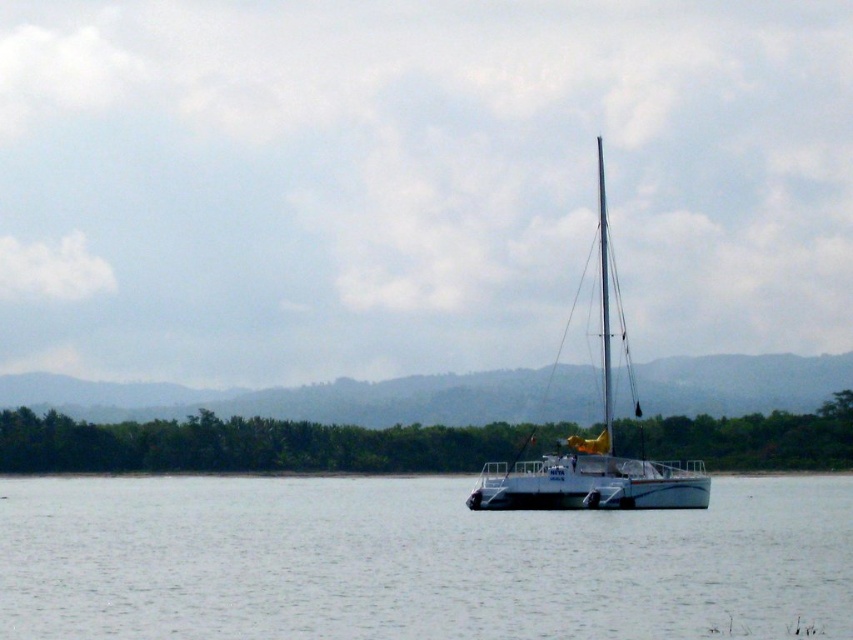
You are standing on a pier and see the clear water at center. If you want to throw a small stone into the water, will it land within 50 meters from where you are standing?

The clear water at center is 49.69 meters away from viewer, so yes, the stone will land within 50 meters from where you are standing.

You are a sailor trying to navigate your boat through the clear water at center. The white matte sailboat at center is in your path. Which direction should you steer to avoid it?

The clear water at center is to the left of the white matte sailboat at center, so you should steer to the right to avoid the white matte sailboat at center.

You are standing on the deck of the sailboat anchored off the right side of the frame and want to move to the clear water at center. Can you walk directly to the point marked by the coordinates (415, 561) without stepping on any obstacles?

The point marked by the coordinates (415, 561) is on clear water at center, so yes, you can walk directly to it without stepping on any obstacles.